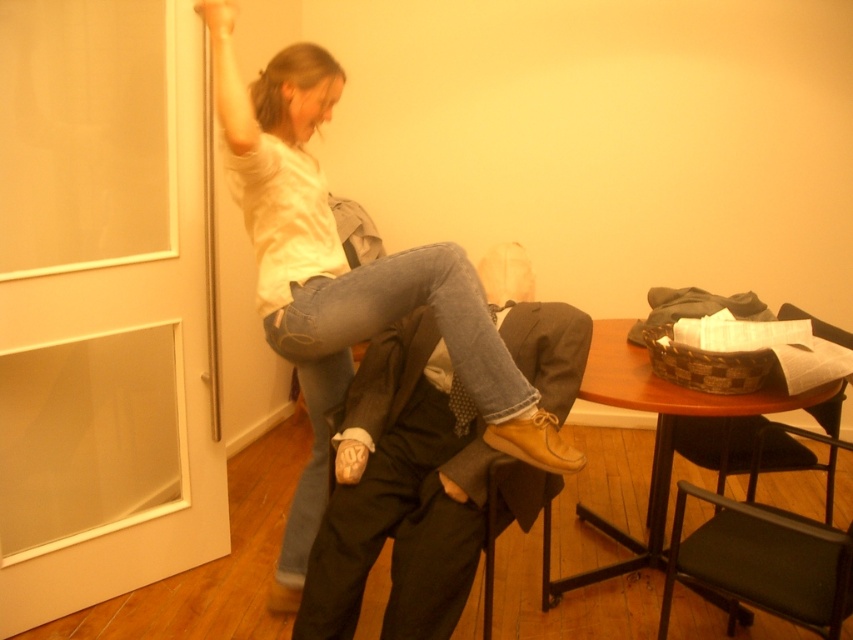
You are trying to exit the room through the door. You see the white translucent screen door at left and the green fabric chair at lower right. Which object is closer to the exit?

The white translucent screen door at left is positioned over the green fabric chair at lower right, so the white translucent screen door at left is closer to the exit.

You are a photographer setting up a shoot in this room. You need to position a small tripod between the denim jeans at center and the green fabric chair at lower right. Can the tripod be placed there without being under either object?

The denim jeans at center is above the green fabric chair at lower right, so there is space between them where the tripod can be placed without being under either object.